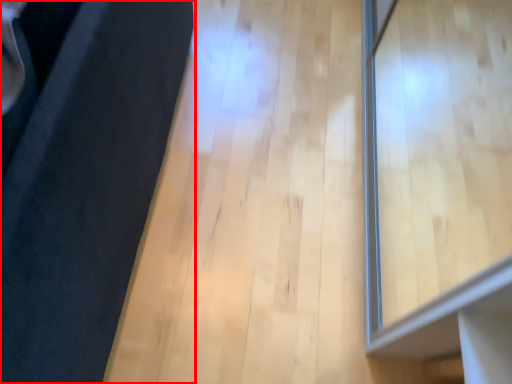
Question: From the image's perspective, what is the correct spatial positioning of furniture (annotated by the red box) in reference to window?

Choices:
 (A) below
 (B) above

Answer: (B)